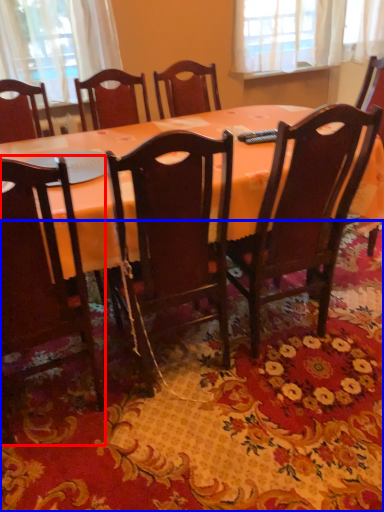
Question: Which point is further to the camera, chair (highlighted by a red box) or mat (highlighted by a blue box)?

Choices:
 (A) chair
 (B) mat

Answer: (B)